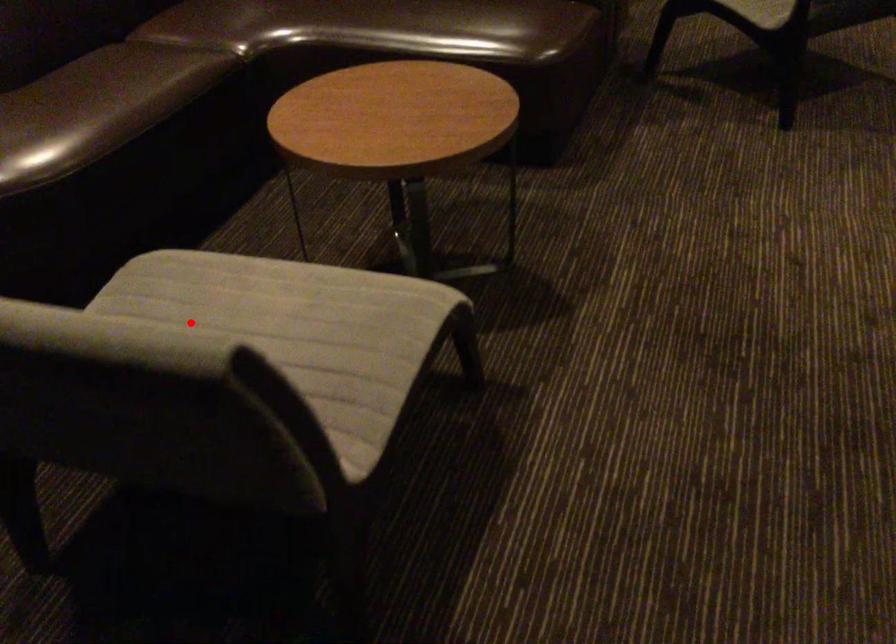
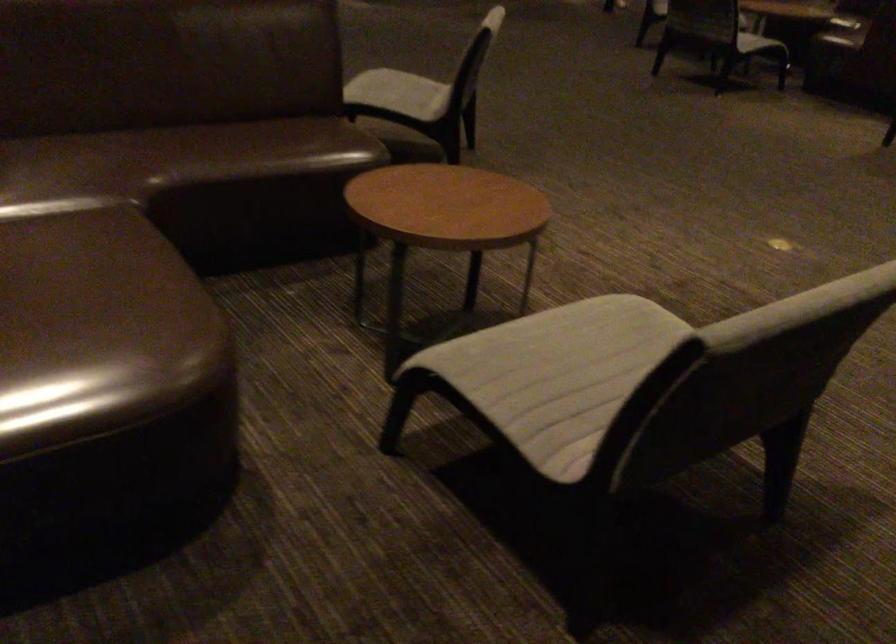
Question: I am providing you with two images of the same scene from different viewpoints. Given a red point in image1, look at the same physical point in image2. Is it:

Choices:
 (A) Closer to the viewpoint
 (B) Farther from the viewpoint

Answer: (B)